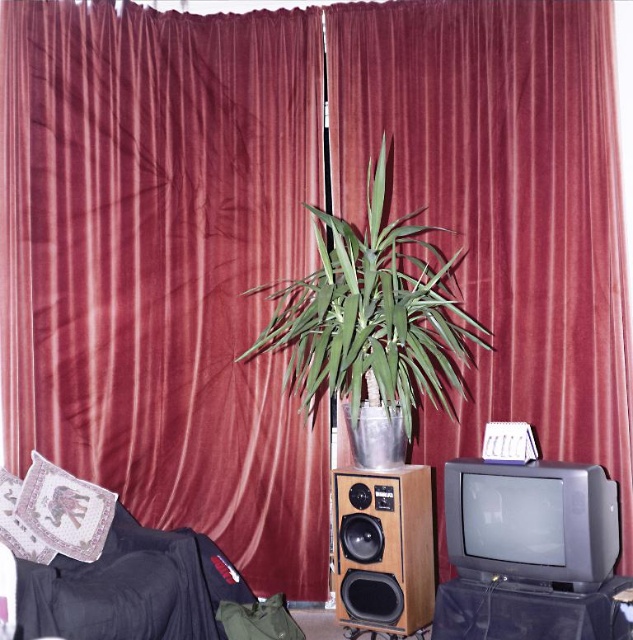
Is green leafy plant at center further to camera compared to embroidered fabric pillow at lower left?

That is False.

Is green leafy plant at center above embroidered fabric pillow at lower left?

Yes, green leafy plant at center is above embroidered fabric pillow at lower left.

This screenshot has width=633, height=640. I want to click on green leafy plant at center, so click(372, 314).

Who is positioned more to the left, green leafy plant at center or wooden speaker at center?

Positioned to the left is green leafy plant at center.

Which of these two, green leafy plant at center or wooden speaker at center, stands shorter?

Standing shorter between the two is wooden speaker at center.

This screenshot has height=640, width=633. What do you see at coordinates (372, 314) in the screenshot?
I see `green leafy plant at center` at bounding box center [372, 314].

You are a GUI agent. You are given a task and a screenshot of the screen. Output one action in this format:
    pyautogui.click(x=<x>, y=<y>)
    Task: Click on the green leafy plant at center
    The width and height of the screenshot is (633, 640).
    Given the screenshot: What is the action you would take?
    pyautogui.click(x=372, y=314)

Between matte black television at lower right and patterned fabric pillow at left, which one has less height?

Standing shorter between the two is patterned fabric pillow at left.

The width and height of the screenshot is (633, 640). Describe the element at coordinates (532, 520) in the screenshot. I see `matte black television at lower right` at that location.

The width and height of the screenshot is (633, 640). Identify the location of matte black television at lower right. (532, 520).